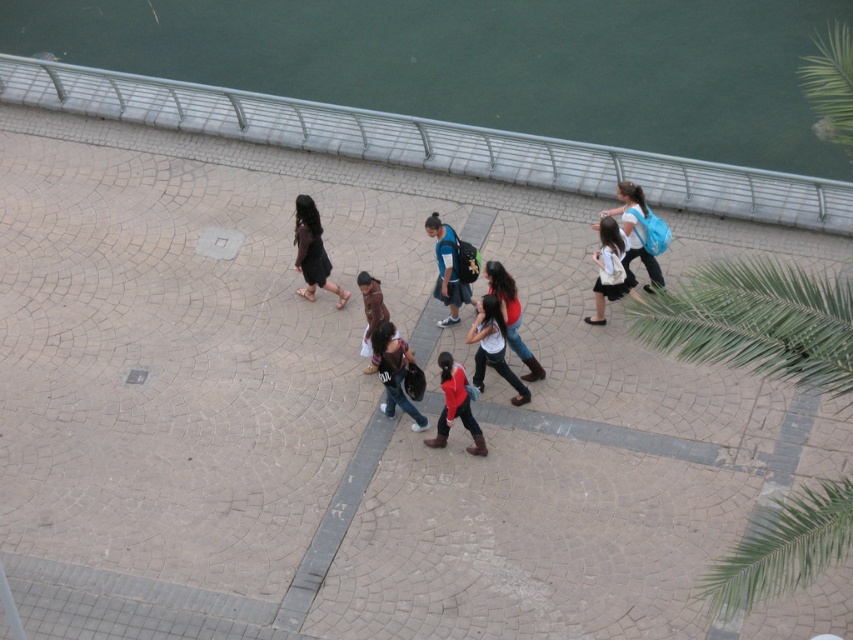
Based on the photo, can you confirm if white matte shirt at center is smaller than matte blue backpack at right?

Correct, white matte shirt at center occupies less space than matte blue backpack at right.

Between point (518, 404) and point (639, 253), which one is positioned behind?

The point (639, 253) is behind.

This screenshot has height=640, width=853. What are the coordinates of `white matte shirt at center` in the screenshot? It's located at (492, 348).

Consider the image. Does blue fabric backpack at center have a lesser width compared to denim jeans at center?

No.

At what (x,y) coordinates should I click in order to perform the action: click on blue fabric backpack at center. Please return your answer as a coordinate pair (x, y). The width and height of the screenshot is (853, 640). Looking at the image, I should click on (450, 269).

Between white fabric skirt at center and brown leather jacket at center, which one has more height?

With more height is white fabric skirt at center.

Is white fabric skirt at center closer to the viewer compared to brown leather jacket at center?

That is False.

What do you see at coordinates (608, 268) in the screenshot? This screenshot has height=640, width=853. I see `white fabric skirt at center` at bounding box center [608, 268].

I want to click on white fabric skirt at center, so click(608, 268).